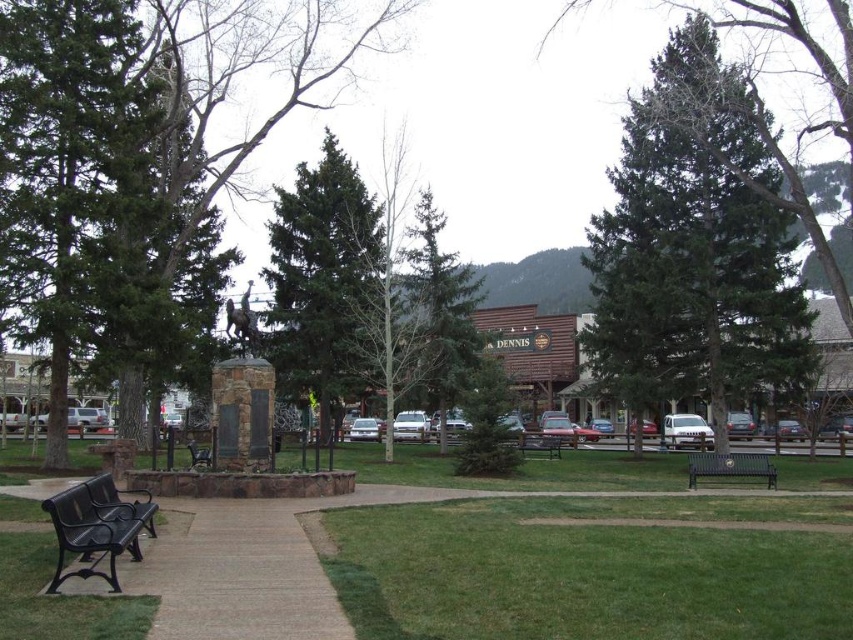
Question: Considering the relative positions of green needle-like tree at center and metallic green bench at lower right in the image provided, where is green needle-like tree at center located with respect to metallic green bench at lower right?

Choices:
 (A) right
 (B) left

Answer: (A)

Question: Which object is positioned farthest from the wooden park bench at center?

Choices:
 (A) metallic green bench at lower right
 (B) green textured tree at center
 (C) green grass at center

Answer: (C)

Question: Among these points, which one is farthest from the camera?

Choices:
 (A) (314, 321)
 (B) (195, 292)

Answer: (B)

Question: Which point is farther to the camera?

Choices:
 (A) (642, 173)
 (B) (838, 548)
 (C) (136, 490)

Answer: (A)

Question: Does green needle-like tree at center have a smaller size compared to wooden park bench at center?

Choices:
 (A) yes
 (B) no

Answer: (B)

Question: Does green coniferous tree at center have a lesser width compared to metallic green bench at lower right?

Choices:
 (A) yes
 (B) no

Answer: (A)